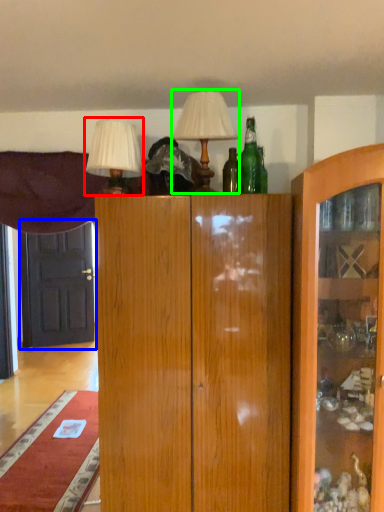
Question: Which is nearer to the table lamp (highlighted by a red box)? door (highlighted by a blue box) or table lamp (highlighted by a green box).

Choices:
 (A) door
 (B) table lamp

Answer: (B)